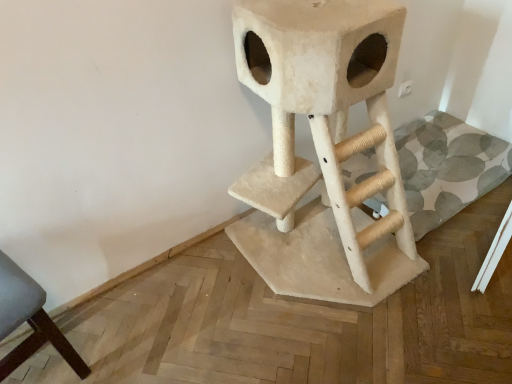
Locate an element on the screen. The height and width of the screenshot is (384, 512). vacant area that lies between dark gray fabric chair at lower left and beige carpeted cat tree at center is located at coordinates (185, 315).